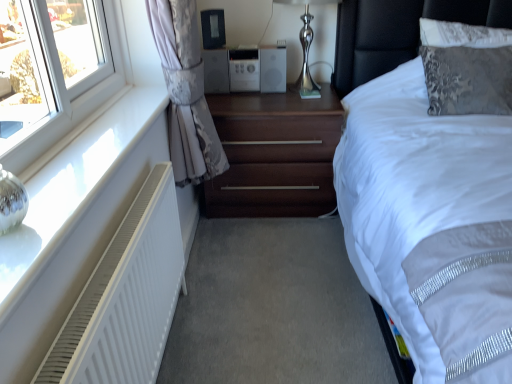
This screenshot has height=384, width=512. Identify the location of empty space that is ontop of white matte radiator at left (from a real-world perspective). [x=128, y=224].